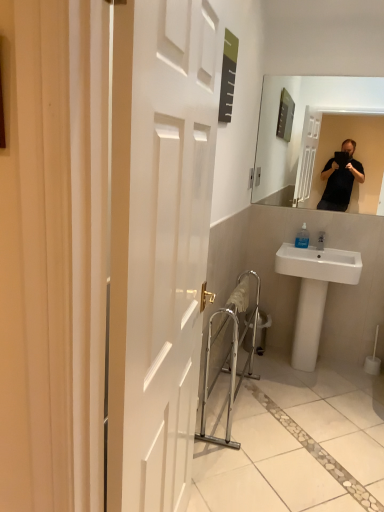
Describe the element at coordinates (314, 292) in the screenshot. This screenshot has width=384, height=512. I see `white ceramic sink at lower right` at that location.

The height and width of the screenshot is (512, 384). What are the coordinates of `silver metallic balustrade at lower center` in the screenshot? It's located at (229, 352).

Can you confirm if transparent plastic soap dispenser at sink is thinner than metallic silver trash can at center?

Yes.

How much distance is there between transparent plastic soap dispenser at sink and metallic silver trash can at center?

They are 27.27 inches apart.

Which is correct: transparent plastic soap dispenser at sink is inside metallic silver trash can at center, or outside of it?

transparent plastic soap dispenser at sink is spatially situated outside metallic silver trash can at center.

Relative to metallic silver trash can at center, is white ceramic sink at lower right in front or behind?

white ceramic sink at lower right is positioned closer to the viewer than metallic silver trash can at center.

Is white ceramic sink at lower right turned away from metallic silver trash can at center?

white ceramic sink at lower right does not have its back to metallic silver trash can at center.

You are a GUI agent. You are given a task and a screenshot of the screen. Output one action in this format:
    pyautogui.click(x=<x>, y=<y>)
    Task: Click on the sink in front of the metallic silver trash can at center
    
    Given the screenshot: What is the action you would take?
    click(x=314, y=292)

Between white ceramic sink at lower right and metallic silver trash can at center, which one has more height?

white ceramic sink at lower right is taller.

Can you tell me how much silver metallic balustrade at lower center and white ceramic sink at lower right differ in facing direction?

silver metallic balustrade at lower center and white ceramic sink at lower right are facing 92.3 degrees away from each other.

Considering the points (251, 318) and (318, 278), which point is in front, point (251, 318) or point (318, 278)?

The point (318, 278) is in front.

Based on their sizes in the image, would you say silver metallic balustrade at lower center is bigger or smaller than white ceramic sink at lower right?

In the image, silver metallic balustrade at lower center appears to be smaller than white ceramic sink at lower right.

Does silver metallic balustrade at lower center come in front of transparent plastic soap dispenser at sink?

Yes, silver metallic balustrade at lower center is closer to the camera.

From the picture: From the image's perspective, is silver metallic balustrade at lower center positioned above or below transparent plastic soap dispenser at sink?

From the image's perspective, silver metallic balustrade at lower center appears below transparent plastic soap dispenser at sink.

Can we say silver metallic balustrade at lower center lies outside transparent plastic soap dispenser at sink?

Yes, silver metallic balustrade at lower center is not within transparent plastic soap dispenser at sink.

This screenshot has width=384, height=512. I want to click on balustrade lying below the transparent plastic soap dispenser at sink (from the image's perspective), so click(x=229, y=352).

Which object is wider, transparent plastic soap dispenser at sink or silver metallic balustrade at lower center?

silver metallic balustrade at lower center.

Between point (300, 229) and point (231, 384), which one is positioned in front?

The point (231, 384) is more forward.

Based on the photo, is transparent plastic soap dispenser at sink in front of silver metallic balustrade at lower center?

No, it is not.

Is metallic silver trash can at center inside or outside of silver metallic balustrade at lower center?

metallic silver trash can at center is not enclosed by silver metallic balustrade at lower center.

Which object is positioned more to the left, metallic silver trash can at center or silver metallic balustrade at lower center?

silver metallic balustrade at lower center.

Considering the relative sizes of metallic silver trash can at center and silver metallic balustrade at lower center in the image provided, is metallic silver trash can at center taller than silver metallic balustrade at lower center?

No, metallic silver trash can at center is not taller than silver metallic balustrade at lower center.

From the image's perspective, does white ceramic sink at lower right appear lower than transparent plastic soap dispenser at sink?

Yes, from the image's perspective, white ceramic sink at lower right is below transparent plastic soap dispenser at sink.

Find the location of `sink in front of the transparent plastic soap dispenser at sink`. sink in front of the transparent plastic soap dispenser at sink is located at coordinates (314, 292).

How far apart are white ceramic sink at lower right and transparent plastic soap dispenser at sink?

37.24 centimeters.

Would you say white ceramic sink at lower right is inside or outside transparent plastic soap dispenser at sink?

white ceramic sink at lower right is located beyond the bounds of transparent plastic soap dispenser at sink.

The height and width of the screenshot is (512, 384). I want to click on trash bin/can behind the transparent plastic soap dispenser at sink, so click(x=262, y=331).

Locate an element on the screen. The image size is (384, 512). sink in front of the metallic silver trash can at center is located at coordinates (314, 292).

Considering their positions, is metallic silver trash can at center positioned closer to silver metallic balustrade at lower center than white ceramic sink at lower right?

metallic silver trash can at center lies closer to silver metallic balustrade at lower center than the other object.

Based on their spatial positions, is transparent plastic soap dispenser at sink or silver metallic balustrade at lower center closer to metallic silver trash can at center?

silver metallic balustrade at lower center is positioned closer to the anchor metallic silver trash can at center.

Looking at the image, which one is located further to silver metallic balustrade at lower center, metallic silver trash can at center or transparent plastic soap dispenser at sink?

Among the two, transparent plastic soap dispenser at sink is located further to silver metallic balustrade at lower center.

Looking at the image, which one is located closer to silver metallic balustrade at lower center, white ceramic sink at lower right or metallic silver trash can at center?

metallic silver trash can at center is closer to silver metallic balustrade at lower center.

Estimate the real-world distances between objects in this image. Which object is closer to metallic silver trash can at center, white ceramic sink at lower right or silver metallic balustrade at lower center?

silver metallic balustrade at lower center lies closer to metallic silver trash can at center than the other object.

Looking at this image, estimate the real-world distances between objects in this image. Which object is further from white ceramic sink at lower right, silver metallic balustrade at lower center or metallic silver trash can at center?

silver metallic balustrade at lower center lies further to white ceramic sink at lower right than the other object.

Looking at this image, looking at the image, which one is located closer to white ceramic sink at lower right, metallic silver trash can at center or silver metallic balustrade at lower center?

metallic silver trash can at center is closer to white ceramic sink at lower right.

Based on their spatial positions, is silver metallic balustrade at lower center or white ceramic sink at lower right closer to metallic silver trash can at center?

silver metallic balustrade at lower center lies closer to metallic silver trash can at center than the other object.

At what (x,y) coordinates should I click in order to perform the action: click on sink positioned between silver metallic balustrade at lower center and transparent plastic soap dispenser at sink from near to far. Please return your answer as a coordinate pair (x, y). The image size is (384, 512). Looking at the image, I should click on (314, 292).

The height and width of the screenshot is (512, 384). I want to click on bottle located between silver metallic balustrade at lower center and metallic silver trash can at center in the depth direction, so click(302, 238).

The width and height of the screenshot is (384, 512). In order to click on sink between silver metallic balustrade at lower center and metallic silver trash can at center along the z-axis in this screenshot , I will do `click(314, 292)`.

Where is `sink between transparent plastic soap dispenser at sink and metallic silver trash can at center vertically`? Image resolution: width=384 pixels, height=512 pixels. sink between transparent plastic soap dispenser at sink and metallic silver trash can at center vertically is located at coordinates (314, 292).